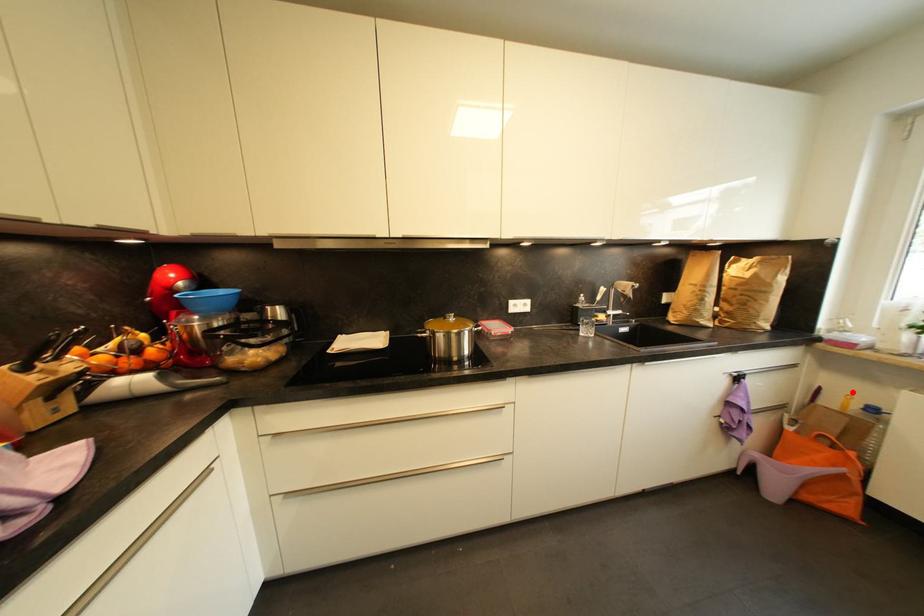
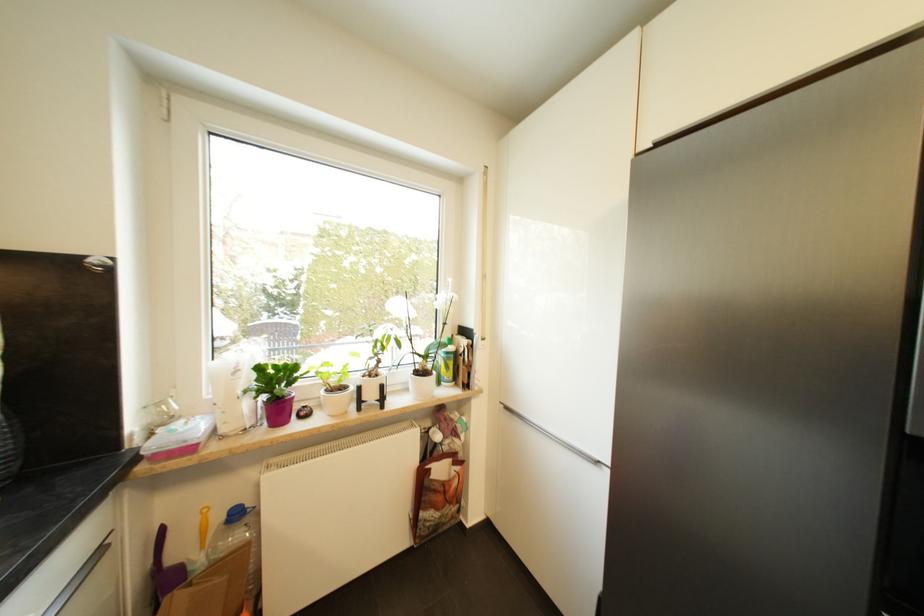
Question: I am providing you with two images of the same scene from different viewpoints. Image1 has a red point marked. In image2, the corresponding 3D location appears at what relative position? Reply with the corresponding letter.

Choices:
 (A) Closer
 (B) Farther

Answer: (A)